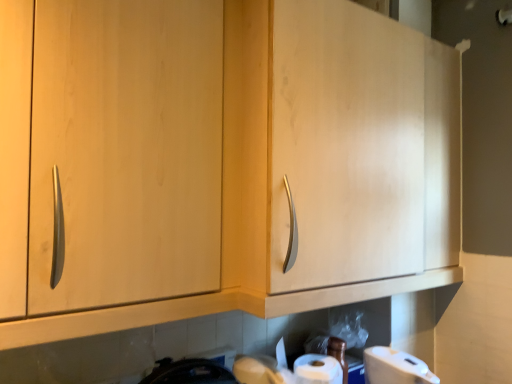
Question: Considering their positions, is matte wood cabinet at center located in front of or behind white matte toilet paper at lower right?

Choices:
 (A) behind
 (B) front

Answer: (B)

Question: From the image's perspective, is matte wood cabinet at center located above or below white matte toilet paper at lower right?

Choices:
 (A) below
 (B) above

Answer: (B)

Question: Is matte wood cabinet at center taller or shorter than white matte toilet paper at lower right?

Choices:
 (A) short
 (B) tall

Answer: (B)

Question: Is point (392, 349) closer or farther from the camera than point (286, 235)?

Choices:
 (A) closer
 (B) farther

Answer: (B)

Question: From a real-world perspective, is white matte toilet paper at lower right physically located above or below matte wood cabinet at center?

Choices:
 (A) below
 (B) above

Answer: (A)

Question: Considering the positions of white matte toilet paper at lower right and matte wood cabinet at center in the image, is white matte toilet paper at lower right bigger or smaller than matte wood cabinet at center?

Choices:
 (A) big
 (B) small

Answer: (B)

Question: Is white matte toilet paper at lower right in front of or behind matte wood cabinet at center in the image?

Choices:
 (A) behind
 (B) front

Answer: (A)